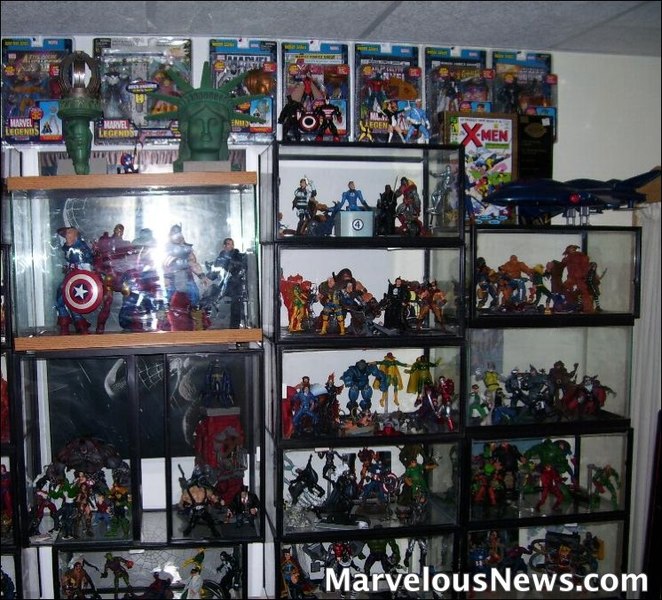
You are a GUI agent. You are given a task and a screenshot of the screen. Output one action in this format:
    pyautogui.click(x=<x>, y=<y>)
    Task: Click on the glass bottom of shelf
    This screenshot has height=600, width=662.
    Given the screenshot: What is the action you would take?
    pyautogui.click(x=158, y=531), pyautogui.click(x=438, y=519), pyautogui.click(x=608, y=504), pyautogui.click(x=433, y=430), pyautogui.click(x=604, y=418)